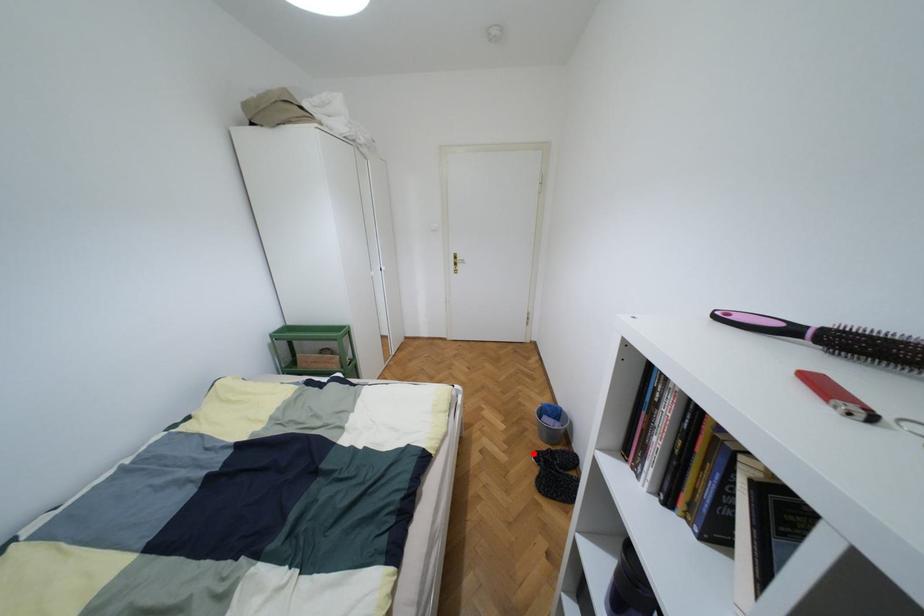
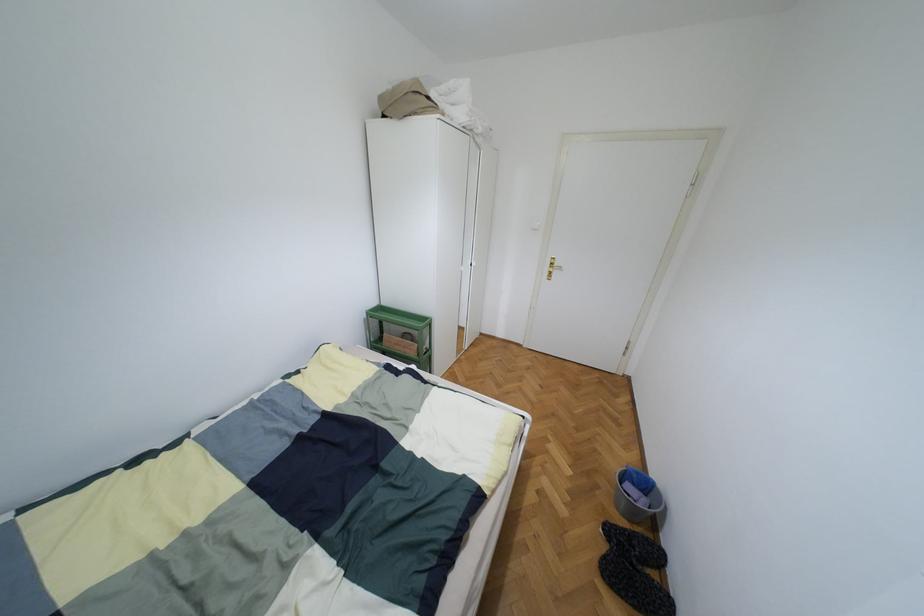
Locate, in the second image, the point that corresponds to the highlighted location in the first image.

(603, 524)